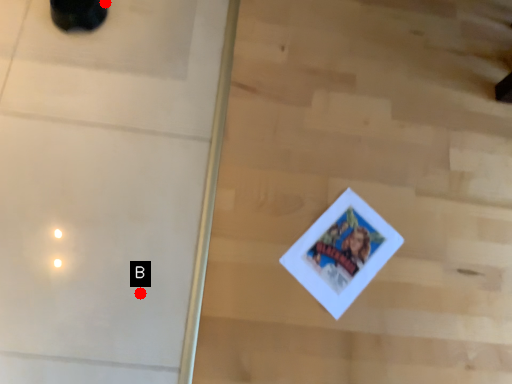
Question: Two points are circled on the image, labeled by A and B beside each circle. Which point is farther from the camera taking this photo?

Choices:
 (A) A is further
 (B) B is further

Answer: (A)